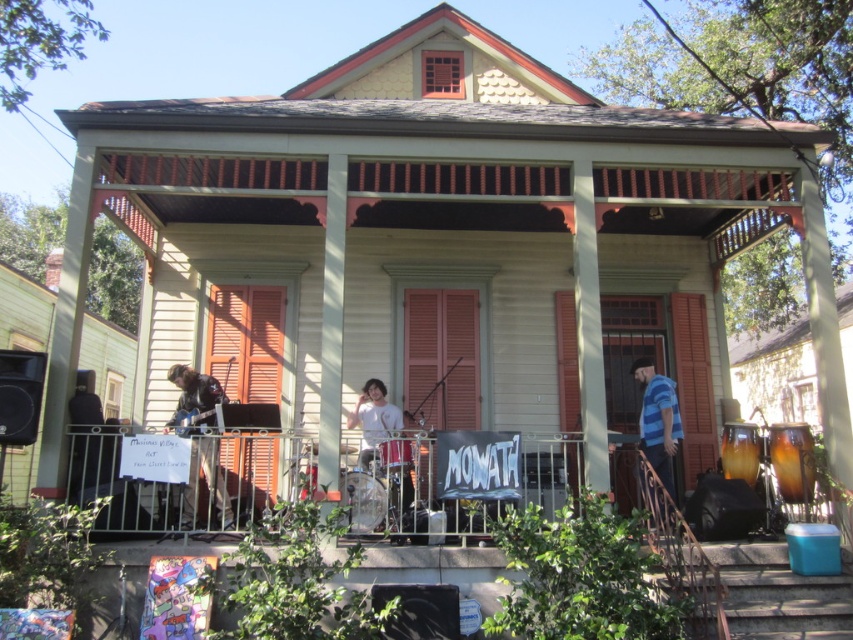
You are a photographer standing on the porch where the band is performing. You want to take a photo that includes both the leather jacket at left and the white matte shirt at center. What is the minimum distance you need to step back to ensure both are fully visible in your camera frame?

The leather jacket at left is 1.75 meters away from the white matte shirt at center. To ensure both are fully visible, you should step back at least 1.75 meters from the closer object, which would be the leather jacket at left. This way, the entire distance between them will be within your camera frame.

You are a photographer trying to capture the band members on the porch. You notice the leather jacket at left and the shiny metallic drum at center. Which object should you focus on first if you want to photograph the larger one?

The leather jacket at left is larger in size than the shiny metallic drum at center, so you should focus on the leather jacket at left first.

You are a photographer taking a group photo of the band members. The leather jacket at left and the white matte shirt at center are in the frame. Which clothing item should you focus on first if you want to capture the larger one?

The leather jacket at left is bigger than the white matte shirt at center, so you should focus on the leather jacket at left first to capture the larger one.